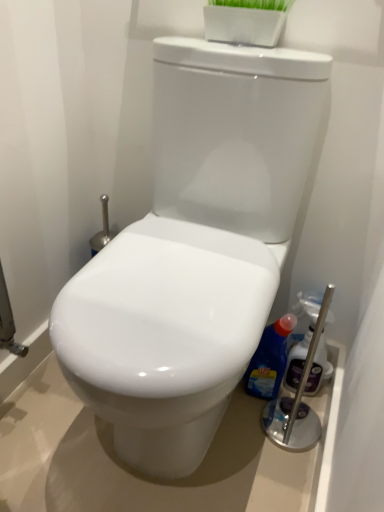
Question: Could you tell me if white glossy toilet at center is facing translucent plastic spray bottle at right, which is counted as the first cleaning product, starting from the right?

Choices:
 (A) yes
 (B) no

Answer: (B)

Question: Does white glossy toilet at center appear on the right side of translucent plastic spray bottle at right, the second cleaning product in the left-to-right sequence?

Choices:
 (A) yes
 (B) no

Answer: (B)

Question: Is white glossy toilet at center next to translucent plastic spray bottle at right, the second cleaning product in the left-to-right sequence, and touching it?

Choices:
 (A) no
 (B) yes

Answer: (A)

Question: Is white glossy toilet at center shorter than translucent plastic spray bottle at right, which is counted as the first cleaning product, starting from the right?

Choices:
 (A) yes
 (B) no

Answer: (B)

Question: Is white glossy toilet at center taller than translucent plastic spray bottle at right, which is counted as the first cleaning product, starting from the right?

Choices:
 (A) yes
 (B) no

Answer: (A)

Question: Is blue glossy bottle at right, positioned as the first cleaning product in left-to-right order, taller or shorter than translucent plastic spray bottle at right, the second cleaning product in the left-to-right sequence?

Choices:
 (A) short
 (B) tall

Answer: (A)

Question: Is blue glossy bottle at right, positioned as the first cleaning product in left-to-right order, inside or outside of translucent plastic spray bottle at right, the second cleaning product in the left-to-right sequence?

Choices:
 (A) outside
 (B) inside

Answer: (A)

Question: Is blue glossy bottle at right, positioned as the first cleaning product in left-to-right order, to the left or to the right of translucent plastic spray bottle at right, which is counted as the first cleaning product, starting from the right, in the image?

Choices:
 (A) right
 (B) left

Answer: (B)

Question: Considering the positions of point (269, 342) and point (304, 352), is point (269, 342) closer or farther from the camera than point (304, 352)?

Choices:
 (A) closer
 (B) farther

Answer: (A)

Question: In terms of height, does white glossy toilet at center look taller or shorter compared to blue glossy bottle at right, placed as the 2th cleaning product when sorted from right to left?

Choices:
 (A) short
 (B) tall

Answer: (B)

Question: Does point (193, 71) appear closer or farther from the camera than point (266, 330)?

Choices:
 (A) closer
 (B) farther

Answer: (A)

Question: Is white glossy toilet at center in front of or behind blue glossy bottle at right, placed as the 2th cleaning product when sorted from right to left, in the image?

Choices:
 (A) behind
 (B) front

Answer: (B)

Question: Based on their sizes in the image, would you say white glossy toilet at center is bigger or smaller than blue glossy bottle at right, placed as the 2th cleaning product when sorted from right to left?

Choices:
 (A) big
 (B) small

Answer: (A)

Question: Is blue glossy bottle at right, placed as the 2th cleaning product when sorted from right to left, spatially inside white glossy toilet at center, or outside of it?

Choices:
 (A) inside
 (B) outside

Answer: (A)

Question: Considering the positions of blue glossy bottle at right, positioned as the first cleaning product in left-to-right order, and white glossy toilet at center in the image, is blue glossy bottle at right, positioned as the first cleaning product in left-to-right order, bigger or smaller than white glossy toilet at center?

Choices:
 (A) big
 (B) small

Answer: (B)